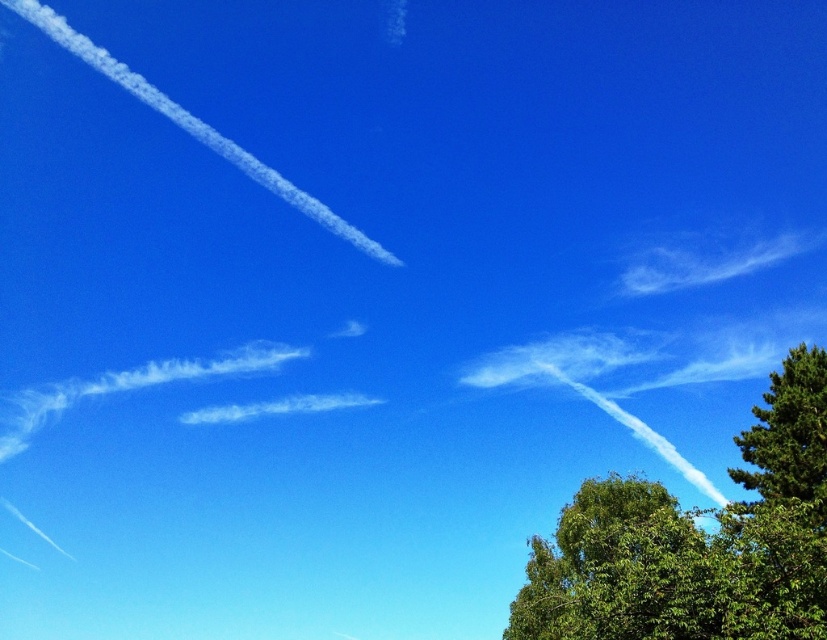
You are standing in the middle of the image looking towards the bottom right corner. Which direction should you move to get closer to the green leafy tree at right?

You should move towards the bottom right direction to get closer to the green leafy tree at right since it is located at point (x=696, y=541), which is in the bottom right corner of the image.

You are standing in a field looking at the sky with two green leafy trees in the distance. One is labeled as the green leafy tree at right and the other as the green leafy tree at lower right. Which tree would appear closer to you based on their positions?

The green leafy tree at lower right appears closer because it is positioned lower in the image, which typically indicates proximity in visual perspective.